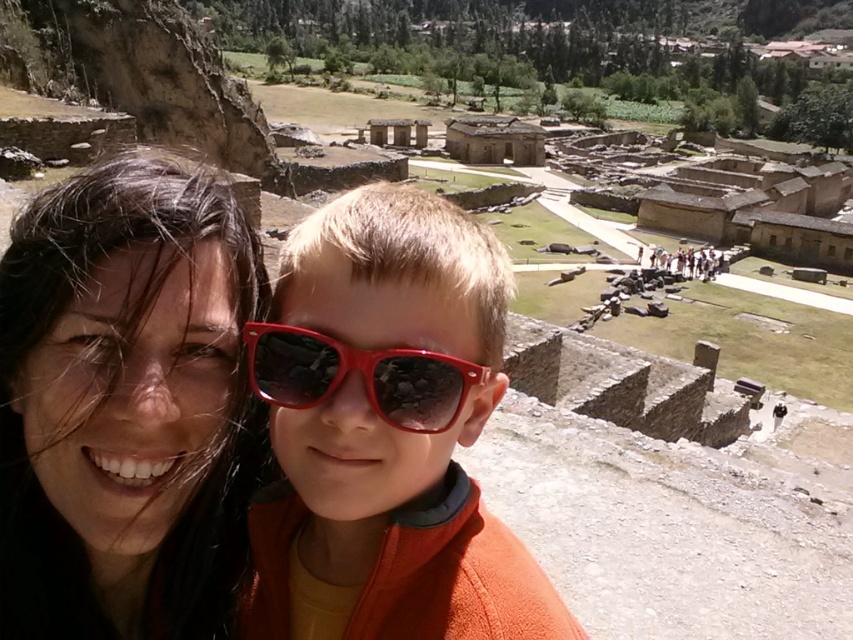
You are a photographer trying to capture a closeup of the matte black hair at upper left and the matte plastic sunglasses at center in the image. Which object should you zoom in on to ensure both are in focus?

The matte black hair at upper left is bigger than the matte plastic sunglasses at center, so you should zoom in on the matte plastic sunglasses at center to ensure both are in focus.

Based on the photo, you are a photographer trying to capture a clear shot of the matte plastic sunglasses at center and the shiny plastic goggles at center. Since both are at the center, which one is positioned lower in the frame?

The matte plastic sunglasses at center is located below the shiny plastic goggles at center, so it is positioned lower in the frame.

You are a photographer trying to capture a closeup of the matte black hair at upper left and the matte plastic sunglasses at center in the image. Which object should you zoom in on to ensure both fit in the frame without cropping?

The matte plastic sunglasses at center has a smaller width than the matte black hair at upper left, so you should zoom in on the matte plastic sunglasses at center to ensure both fit in the frame without cropping.